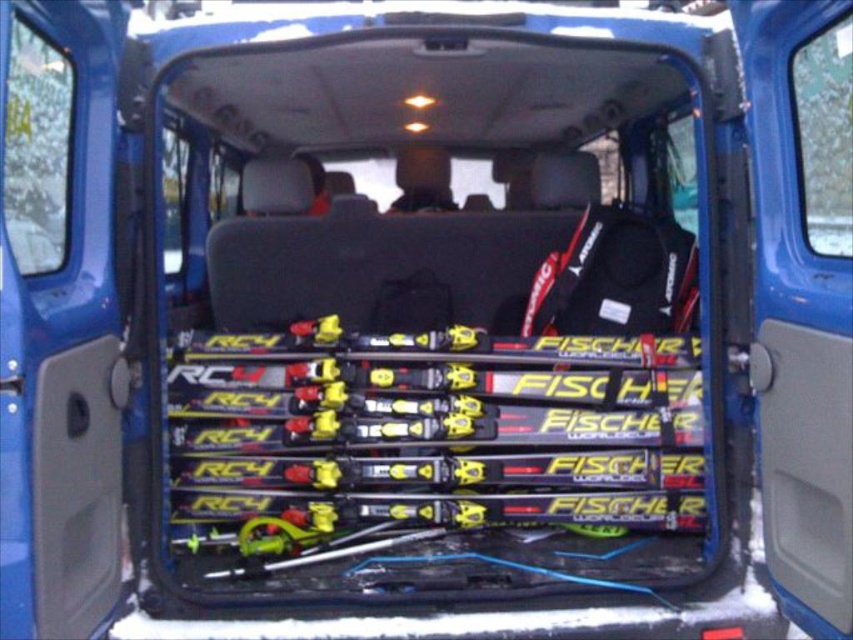
You are a delivery person who needs to retrieve the matte black ski bag at center from the cargo area of the van. The cargo area has a yellow matte fischer rc4 ski at center blocking the access. Can you move the ski to the right to get to the bag?

The yellow matte fischer rc4 ski at center is to the left of the matte black ski bag at center, so moving the ski to the right would allow access to the bag.

You are trying to decide whether to place a new pair of skis in the cargo area of the vehicle. The new skis are the same size as the yellow matte fischer rc4 ski at center. You have a matte black ski bag at center that you want to use to store them. Will the ski bag be big enough to fit the new skis?

The yellow matte fischer rc4 ski at center is larger in size than the matte black ski bag at center. Therefore, the matte black ski bag at center may not be big enough to fit the new skis, as they are the same size as the larger ski.

You are packing a van for a ski trip and need to place the yellow matte fischer rc4 ski at center and the matte black ski bag at center in the cargo area. Based on their widths, which item will require more space horizontally?

The yellow matte fischer rc4 ski at center requires more horizontal space because its width surpasses that of the matte black ski bag at center.